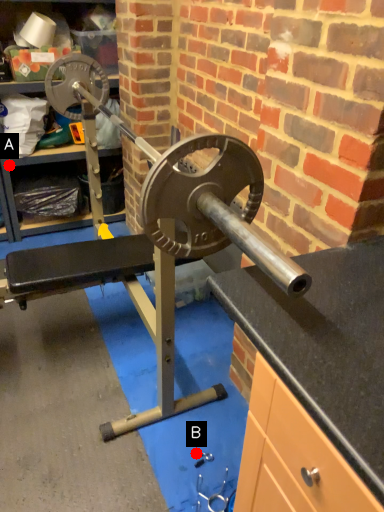
Question: Two points are circled on the image, labeled by A and B beside each circle. Among these points, which one is farthest from the camera?

Choices:
 (A) A is further
 (B) B is further

Answer: (A)